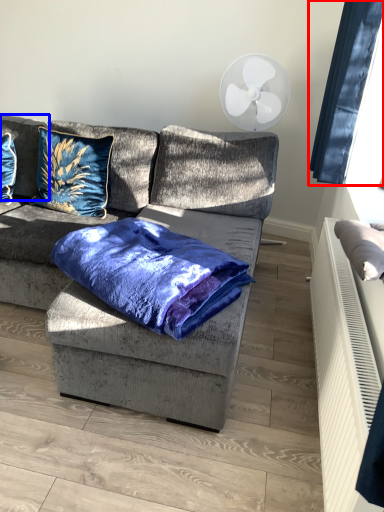
Question: Among these objects, which one is nearest to the camera, window screen (highlighted by a red box) or pillow (highlighted by a blue box)?

Choices:
 (A) window screen
 (B) pillow

Answer: (A)